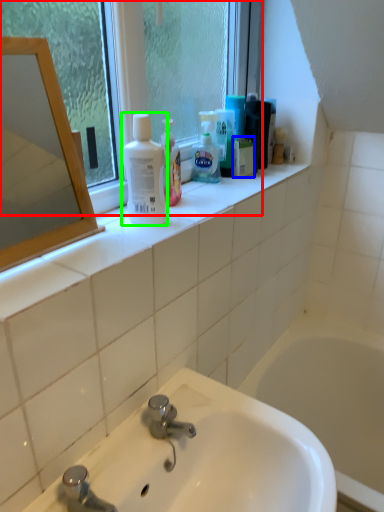
Question: Which object is the farthest from window (highlighted by a red box)? Choose among these: mouthwash (highlighted by a blue box) or cleaning product (highlighted by a green box).

Choices:
 (A) mouthwash
 (B) cleaning product

Answer: (A)